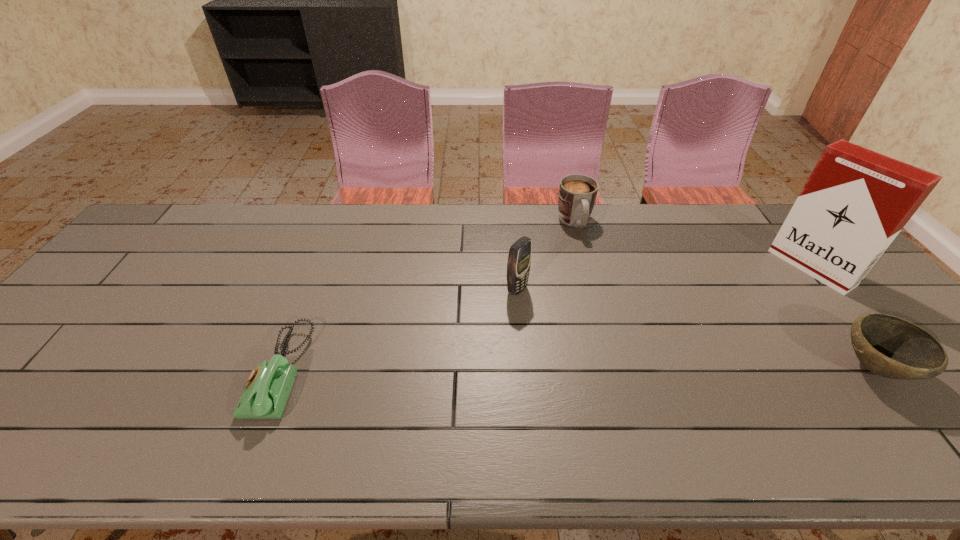
At what (x,y) coordinates should I click in order to perform the action: click on free location located on the front-facing side of the tallest object. Please return your answer as a coordinate pair (x, y). The height and width of the screenshot is (540, 960). Looking at the image, I should click on (723, 327).

Locate an element on the screen. The height and width of the screenshot is (540, 960). mug located at the far edge is located at coordinates (577, 193).

At what (x,y) coordinates should I click in order to perform the action: click on cigarette_case at the far edge. Please return your answer as a coordinate pair (x, y). This screenshot has width=960, height=540. Looking at the image, I should click on (855, 202).

Where is `telephone that is at the near edge`? This screenshot has width=960, height=540. telephone that is at the near edge is located at coordinates (267, 389).

This screenshot has width=960, height=540. Identify the location of bowl at the near edge. (888, 346).

You are a GUI agent. You are given a task and a screenshot of the screen. Output one action in this format:
    pyautogui.click(x=<x>, y=<y>)
    Task: Click on the bowl positioned at the right edge
    
    Given the screenshot: What is the action you would take?
    pyautogui.click(x=888, y=346)

Identify the location of cigarette_case that is at the right edge. The image size is (960, 540). (855, 202).

The width and height of the screenshot is (960, 540). In order to click on object positioned at the far right corner in this screenshot , I will do `click(855, 202)`.

Where is `object located in the near right corner section of the desktop`? The width and height of the screenshot is (960, 540). object located in the near right corner section of the desktop is located at coordinates (888, 346).

This screenshot has width=960, height=540. Identify the location of vacant point at the far edge. (291, 237).